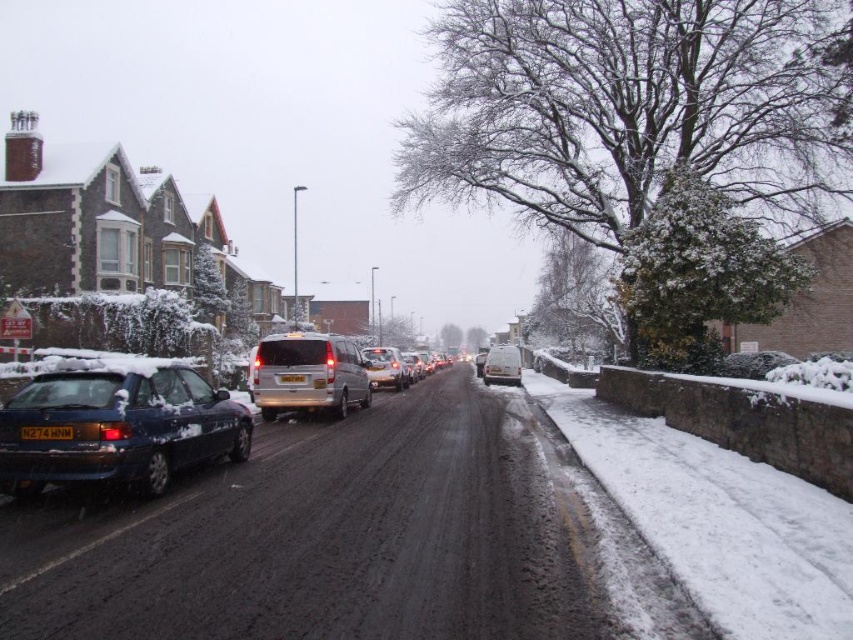
Question: Which point appears farthest from the camera in this image?

Choices:
 (A) (97, 417)
 (B) (283, 376)
 (C) (263, 387)
 (D) (30, 429)

Answer: (C)

Question: Does white matte van at center appear on the right side of black plastic license plate at center?

Choices:
 (A) yes
 (B) no

Answer: (A)

Question: Which object appears farthest from the camera in this image?

Choices:
 (A) shiny gold car at center
 (B) black plastic license plate at center

Answer: (A)

Question: Where is shiny gold car at center located in relation to white plastic license plate at center in the image?

Choices:
 (A) above
 (B) below

Answer: (B)

Question: Does white matte van at center appear on the right side of black plastic license plate at center?

Choices:
 (A) yes
 (B) no

Answer: (A)

Question: Based on their relative distances, which object is nearer to the black plastic license plate at center?

Choices:
 (A) matte blue hatchback at left
 (B) white matte van at center

Answer: (A)